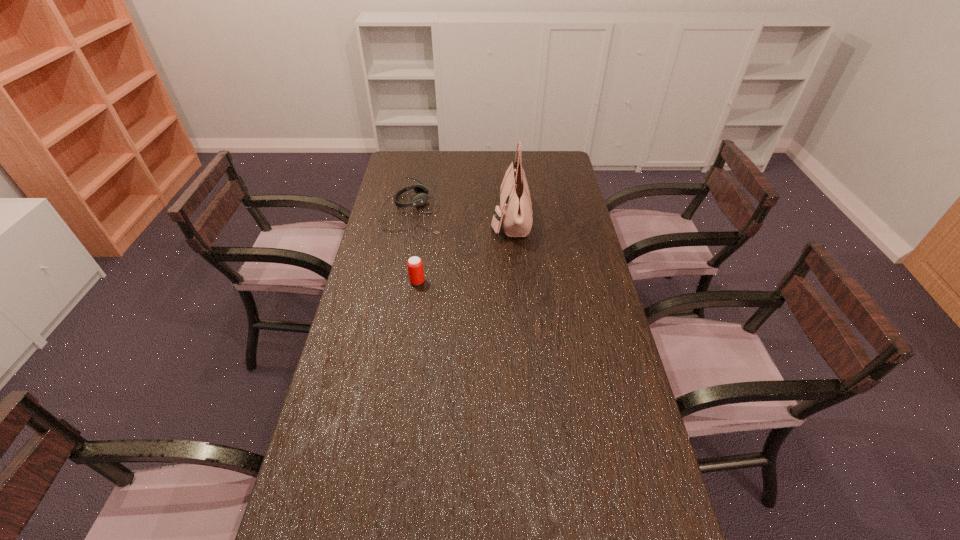
This screenshot has width=960, height=540. I want to click on vacant space that satisfies the following two spatial constraints: 1. on the outer surface of the headset; 2. on the left side of the beer can, so click(x=398, y=281).

Where is `free space that satisfies the following two spatial constraints: 1. on the back side of the nearest object; 2. on the outer surface of the headset`? This screenshot has height=540, width=960. free space that satisfies the following two spatial constraints: 1. on the back side of the nearest object; 2. on the outer surface of the headset is located at coordinates (427, 211).

Locate an element on the screen. The height and width of the screenshot is (540, 960). vacant area in the image that satisfies the following two spatial constraints: 1. on the outer surface of the second tallest object; 2. on the right side of the headset is located at coordinates (398, 281).